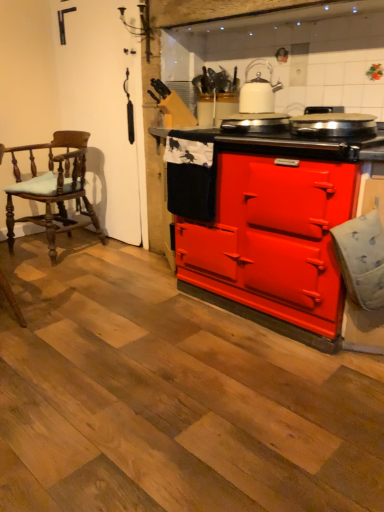
Question: Should I look upward or downward to see red matte stove at center, placed as the 1th appliance when sorted from left to right?

Choices:
 (A) down
 (B) up

Answer: (B)

Question: Does red matte stove at center, marked as the second appliance in a right-to-left arrangement, appear on the left side of matte red stove at center?

Choices:
 (A) yes
 (B) no

Answer: (A)

Question: Is red matte stove at center, placed as the 1th appliance when sorted from left to right, outside of matte red stove at center?

Choices:
 (A) yes
 (B) no

Answer: (B)

Question: Is red matte stove at center, marked as the second appliance in a right-to-left arrangement, taller than matte red stove at center?

Choices:
 (A) no
 (B) yes

Answer: (A)

Question: From a real-world perspective, does red matte stove at center, placed as the 1th appliance when sorted from left to right, sit lower than matte red stove at center?

Choices:
 (A) yes
 (B) no

Answer: (B)

Question: From the image's perspective, would you say red matte stove at center, placed as the 1th appliance when sorted from left to right, is shown under matte red stove at center?

Choices:
 (A) no
 (B) yes

Answer: (A)

Question: Is red matte stove at center, placed as the 1th appliance when sorted from left to right, closer to the viewer compared to matte red stove at center?

Choices:
 (A) yes
 (B) no

Answer: (B)

Question: Would you say white glossy kettle at upper center is part of red matte stove at center, marked as the second appliance in a right-to-left arrangement,'s contents?

Choices:
 (A) yes
 (B) no

Answer: (B)

Question: Is the depth of red matte stove at center, placed as the 1th appliance when sorted from left to right, greater than that of white glossy kettle at upper center?

Choices:
 (A) yes
 (B) no

Answer: (B)

Question: Considering the relative sizes of red matte stove at center, marked as the second appliance in a right-to-left arrangement, and white glossy kettle at upper center in the image provided, is red matte stove at center, marked as the second appliance in a right-to-left arrangement, shorter than white glossy kettle at upper center?

Choices:
 (A) yes
 (B) no

Answer: (A)

Question: From a real-world perspective, is red matte stove at center, placed as the 1th appliance when sorted from left to right, positioned under white glossy kettle at upper center based on gravity?

Choices:
 (A) yes
 (B) no

Answer: (A)

Question: Does red matte stove at center, placed as the 1th appliance when sorted from left to right, appear on the left side of white glossy kettle at upper center?

Choices:
 (A) yes
 (B) no

Answer: (A)

Question: Considering the relative sizes of red matte stove at center, placed as the 1th appliance when sorted from left to right, and white glossy kettle at upper center in the image provided, is red matte stove at center, placed as the 1th appliance when sorted from left to right, wider than white glossy kettle at upper center?

Choices:
 (A) yes
 (B) no

Answer: (A)

Question: Is white glossy kettle at upper center facing away from matte red stove at center?

Choices:
 (A) yes
 (B) no

Answer: (B)